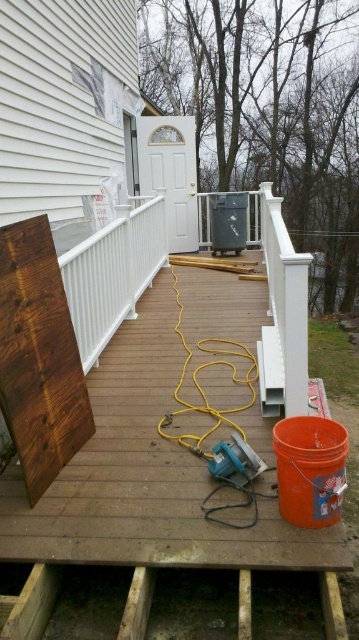
Question: Is brown wood board at left positioned behind white matte rail at center?

Choices:
 (A) yes
 (B) no

Answer: (B)

Question: Which of the following is the farthest from the observer?

Choices:
 (A) brown wood board at left
 (B) white matte rail at center

Answer: (B)

Question: Is brown wood board at left above white matte rail at center?

Choices:
 (A) yes
 (B) no

Answer: (B)

Question: Is brown wood board at left positioned at the back of white matte rail at center?

Choices:
 (A) no
 (B) yes

Answer: (A)